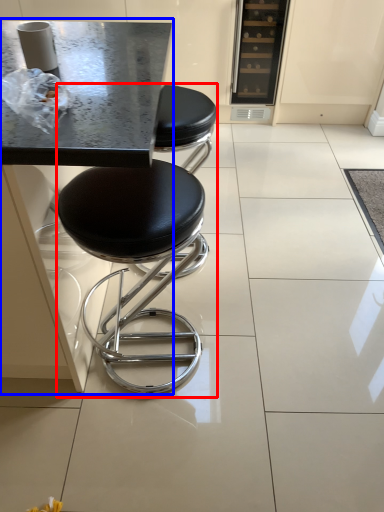
Question: Which point is closer to the camera, stool (highlighted by a red box) or round table (highlighted by a blue box)?

Choices:
 (A) stool
 (B) round table

Answer: (B)